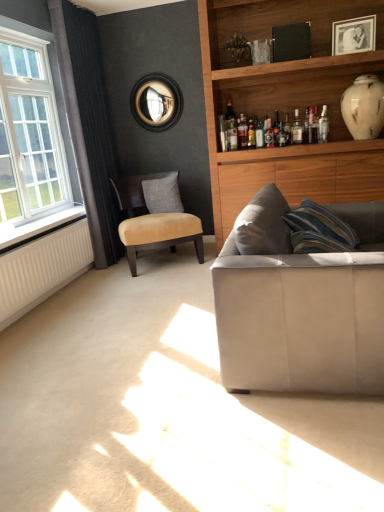
Question: Is suede-like beige couch at lower right bigger than white glossy vase at upper right?

Choices:
 (A) no
 (B) yes

Answer: (B)

Question: Is suede-like beige couch at lower right taller than white glossy vase at upper right?

Choices:
 (A) yes
 (B) no

Answer: (A)

Question: Can you confirm if suede-like beige couch at lower right is positioned to the right of white glossy vase at upper right?

Choices:
 (A) yes
 (B) no

Answer: (B)

Question: Is suede-like beige couch at lower right shorter than white glossy vase at upper right?

Choices:
 (A) yes
 (B) no

Answer: (B)

Question: From a real-world perspective, is suede-like beige couch at lower right beneath white glossy vase at upper right?

Choices:
 (A) no
 (B) yes

Answer: (B)

Question: Considering their positions, is white plastic window sill at left located in front of or behind translucent glass bottle at upper center, the 1th bottle from the right?

Choices:
 (A) behind
 (B) front

Answer: (B)

Question: Would you say white plastic window sill at left is inside or outside translucent glass bottle at upper center, the 1th bottle from the right?

Choices:
 (A) outside
 (B) inside

Answer: (A)

Question: From the image's perspective, is white plastic window sill at left positioned above or below translucent glass bottle at upper center, the 2th bottle positioned from the left?

Choices:
 (A) below
 (B) above

Answer: (A)

Question: From a real-world perspective, is white plastic window sill at left positioned above or below translucent glass bottle at upper center, the 1th bottle from the right?

Choices:
 (A) below
 (B) above

Answer: (A)

Question: From the image's perspective, is white glass window at left above or below translucent glass bottle at upper center, positioned as the first bottle in left-to-right order?

Choices:
 (A) above
 (B) below

Answer: (B)

Question: Considering their positions, is white glass window at left located in front of or behind translucent glass bottle at upper center, arranged as the 2th bottle when viewed from the right?

Choices:
 (A) behind
 (B) front

Answer: (B)

Question: Is white glass window at left to the left or to the right of translucent glass bottle at upper center, arranged as the 2th bottle when viewed from the right, in the image?

Choices:
 (A) left
 (B) right

Answer: (A)

Question: Considering the positions of white glass window at left and translucent glass bottle at upper center, positioned as the first bottle in left-to-right order, in the image, is white glass window at left wider or thinner than translucent glass bottle at upper center, positioned as the first bottle in left-to-right order,?

Choices:
 (A) thin
 (B) wide

Answer: (B)

Question: From a real-world perspective, is suede/leather chair at center-left above or below suede-like beige couch at lower right?

Choices:
 (A) above
 (B) below

Answer: (A)

Question: In the image, is suede/leather chair at center-left positioned in front of or behind suede-like beige couch at lower right?

Choices:
 (A) front
 (B) behind

Answer: (B)